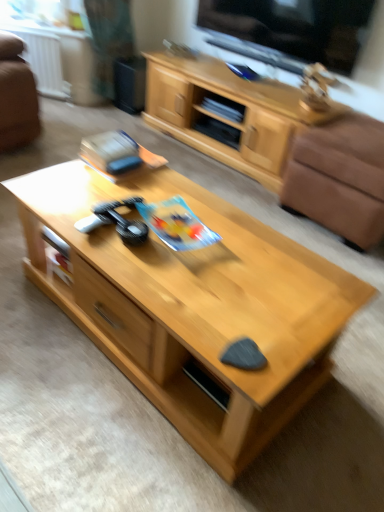
What is the approximate width of white plastic radiator at upper left?

It is 3.25 inches.

The image size is (384, 512). In order to click on brown leather armchair at right in this screenshot , I will do 340,178.

Image resolution: width=384 pixels, height=512 pixels. In order to click on light wood cabinet at upper center in this screenshot , I will do `click(228, 114)`.

At what (x,y) coordinates should I click in order to perform the action: click on white plastic radiator at upper left. Please return your answer as a coordinate pair (x, y). This screenshot has width=384, height=512. Looking at the image, I should click on 44,62.

Can you tell me how much black glossy tv at upper center and light wood coffee table at center differ in facing direction?

The facing directions of black glossy tv at upper center and light wood coffee table at center are 179 degrees apart.

Based on the photo, does black glossy tv at upper center have a larger size compared to light wood coffee table at center?

Actually, black glossy tv at upper center might be smaller than light wood coffee table at center.

Considering the sizes of objects black glossy tv at upper center and light wood coffee table at center in the image provided, who is thinner, black glossy tv at upper center or light wood coffee table at center?

Thinner between the two is black glossy tv at upper center.

Does black glossy tv at upper center come in front of light wood coffee table at center?

No.

Is the surface of white plastic radiator at upper left in direct contact with black glossy tv at upper center?

No, white plastic radiator at upper left is not in contact with black glossy tv at upper center.

Which is more to the right, white plastic radiator at upper left or black glossy tv at upper center?

Positioned to the right is black glossy tv at upper center.

Relative to black glossy tv at upper center, is white plastic radiator at upper left in front or behind?

white plastic radiator at upper left is behind black glossy tv at upper center.

Consider the image. Is black glossy tv at upper center not near white plastic radiator at upper left?

Indeed, black glossy tv at upper center is not near white plastic radiator at upper left.

From a real-world perspective, relative to white plastic radiator at upper left, is black glossy tv at upper center vertically above or below?

Clearly, from a real-world perspective, black glossy tv at upper center is above white plastic radiator at upper left.

Which of these two, black glossy tv at upper center or white plastic radiator at upper left, is smaller?

white plastic radiator at upper left.

Is black glossy tv at upper center oriented towards white plastic radiator at upper left?

No, black glossy tv at upper center is not aimed at white plastic radiator at upper left.

Considering the positions of objects brown leather armchair at right and light wood coffee table at center in the image provided, who is behind, brown leather armchair at right or light wood coffee table at center?

brown leather armchair at right is behind.

Is brown leather armchair at right at the right side of light wood coffee table at center?

Yes, brown leather armchair at right is to the right of light wood coffee table at center.

Is point (310, 159) less distant than point (206, 395)?

No, (310, 159) is further to viewer.

The image size is (384, 512). Find the location of `coffee table on the left side of brown leather armchair at right`. coffee table on the left side of brown leather armchair at right is located at coordinates click(193, 306).

Relative to brown leather armchair at right, is white plastic radiator at upper left in front or behind?

Clearly, white plastic radiator at upper left is behind brown leather armchair at right.

Choose the correct answer: Is white plastic radiator at upper left inside brown leather armchair at right or outside it?

white plastic radiator at upper left lies outside brown leather armchair at right.

From their relative heights in the image, would you say white plastic radiator at upper left is taller or shorter than brown leather armchair at right?

Clearly, white plastic radiator at upper left is taller compared to brown leather armchair at right.

Between white plastic radiator at upper left and brown leather armchair at right, which one has larger width?

Wider between the two is brown leather armchair at right.

From the image's perspective, would you say light wood cabinet at upper center is shown under light wood coffee table at center?

Actually, light wood cabinet at upper center appears above light wood coffee table at center in the image.

Find the location of a particular element. This screenshot has width=384, height=512. cabinetry on the right of light wood coffee table at center is located at coordinates (228, 114).

Is light wood cabinet at upper center at the right side of light wood coffee table at center?

Yes, light wood cabinet at upper center is to the right of light wood coffee table at center.

Is light wood cabinet at upper center positioned with its back to light wood coffee table at center?

No, light wood cabinet at upper center's orientation is not away from light wood coffee table at center.

Which of these two, light wood cabinet at upper center or black glossy tv at upper center, is smaller?

With smaller size is black glossy tv at upper center.

Is point (216, 123) positioned after point (301, 6)?

Yes, point (216, 123) is farther from viewer.

Is black glossy tv at upper center surrounded by light wood cabinet at upper center?

Actually, black glossy tv at upper center is outside light wood cabinet at upper center.

Is the position of light wood cabinet at upper center less distant than that of black glossy tv at upper center?

No, light wood cabinet at upper center is further to the viewer.

Locate an element on the screen. The width and height of the screenshot is (384, 512). coffee table below the black glossy tv at upper center (from a real-world perspective) is located at coordinates (193, 306).

Image resolution: width=384 pixels, height=512 pixels. In order to click on window screen lying in front of the white plastic radiator at upper left in this screenshot , I will do `click(294, 27)`.

Consider the image. Which object lies further to the anchor point white plastic radiator at upper left, light wood coffee table at center or light wood cabinet at upper center?

light wood coffee table at center lies further to white plastic radiator at upper left than the other object.

Which object lies further to the anchor point light wood cabinet at upper center, light wood coffee table at center or black glossy tv at upper center?

Based on the image, light wood coffee table at center appears to be further to light wood cabinet at upper center.

Considering their positions, is light wood cabinet at upper center positioned further to black glossy tv at upper center than brown leather armchair at right?

brown leather armchair at right.

Considering their positions, is brown leather armchair at right positioned closer to light wood cabinet at upper center than black glossy tv at upper center?

The object closer to light wood cabinet at upper center is black glossy tv at upper center.

Considering their positions, is white plastic radiator at upper left positioned further to black glossy tv at upper center than light wood cabinet at upper center?

white plastic radiator at upper left.

From the image, which object appears to be farther from black glossy tv at upper center, light wood coffee table at center or light wood cabinet at upper center?

light wood coffee table at center lies further to black glossy tv at upper center than the other object.

When comparing their distances from white plastic radiator at upper left, does light wood coffee table at center or black glossy tv at upper center seem closer?

black glossy tv at upper center lies closer to white plastic radiator at upper left than the other object.

Looking at the image, which one is located further to black glossy tv at upper center, brown leather armchair at right or light wood cabinet at upper center?

The object further to black glossy tv at upper center is brown leather armchair at right.

Identify the location of cabinetry that lies between black glossy tv at upper center and light wood coffee table at center from top to bottom. The height and width of the screenshot is (512, 384). (228, 114).

Locate an element on the screen. armchair between black glossy tv at upper center and light wood coffee table at center in the vertical direction is located at coordinates (340, 178).

Image resolution: width=384 pixels, height=512 pixels. What are the coordinates of `window screen between white plastic radiator at upper left and brown leather armchair at right from left to right` in the screenshot? It's located at (294, 27).

Where is `coffee table located between white plastic radiator at upper left and brown leather armchair at right in the left-right direction`? This screenshot has height=512, width=384. coffee table located between white plastic radiator at upper left and brown leather armchair at right in the left-right direction is located at coordinates (193, 306).